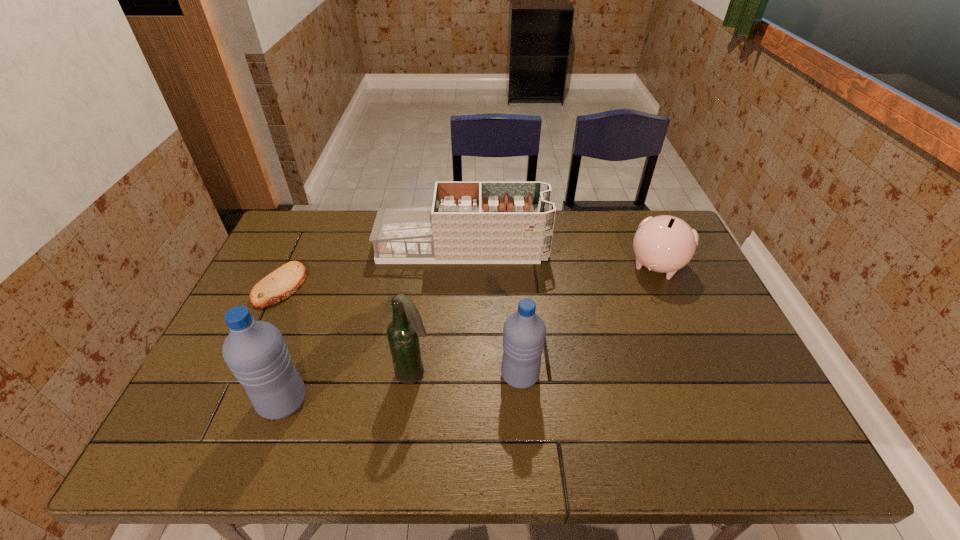
Image resolution: width=960 pixels, height=540 pixels. I want to click on the fifth object from right to left, so click(x=255, y=351).

You are a GUI agent. You are given a task and a screenshot of the screen. Output one action in this format:
    pyautogui.click(x=<x>, y=<y>)
    Task: Click on the left water bottle
    Image resolution: width=960 pixels, height=540 pixels.
    Given the screenshot: What is the action you would take?
    pyautogui.click(x=255, y=351)

This screenshot has width=960, height=540. I want to click on the right water bottle, so click(x=524, y=331).

Where is `the shortest object`? The height and width of the screenshot is (540, 960). the shortest object is located at coordinates (280, 284).

The image size is (960, 540). Identify the location of pita bread. (280, 284).

Find the location of a particular element. The image size is (960, 540). dollhouse is located at coordinates (468, 222).

Where is `piggy bank`? This screenshot has height=540, width=960. piggy bank is located at coordinates (665, 244).

Identify the location of beer bottle. The height and width of the screenshot is (540, 960). (403, 333).

You are a GUI agent. You are given a task and a screenshot of the screen. Output one action in this format:
    pyautogui.click(x=<x>, y=<y>)
    Task: Click on the vacant space situated 0.390m on the right of the taller water bottle
    The width and height of the screenshot is (960, 540).
    Given the screenshot: What is the action you would take?
    pyautogui.click(x=475, y=401)

This screenshot has width=960, height=540. In order to click on free spot located 0.370m on the left of the right water bottle in this screenshot , I will do `click(348, 375)`.